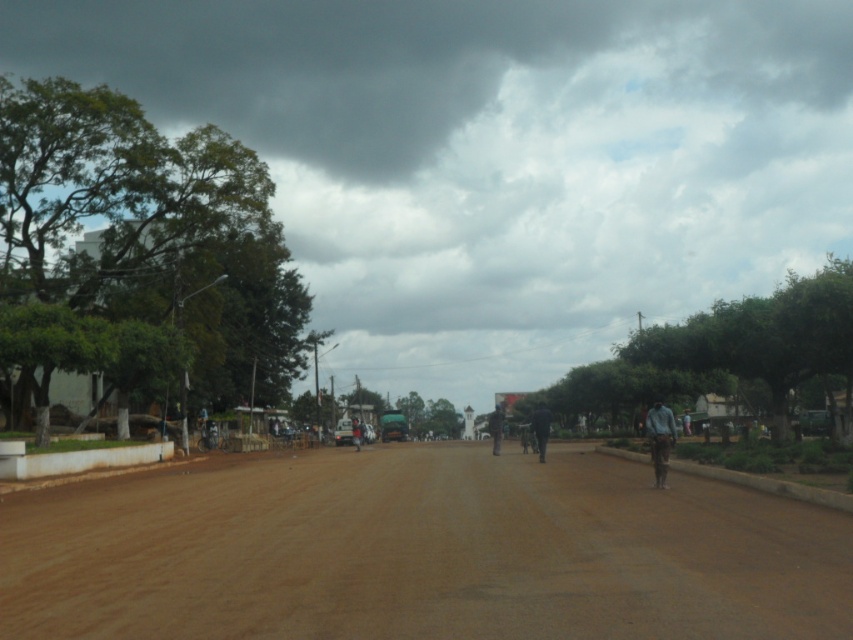
You are a hiker standing on the unpaved road and see the dark blue uniform at center and the dark blue fabric person at center ahead of you. Which object is larger in size?

The dark blue uniform at center is bigger than the dark blue fabric person at center.

You are standing at the starting point of the road and want to reach the distant horizon. Which direction should you move to stay on the brown dirt track at center?

The brown dirt track at center is located at point (421,554), so you should move towards the center direction to stay on the track.